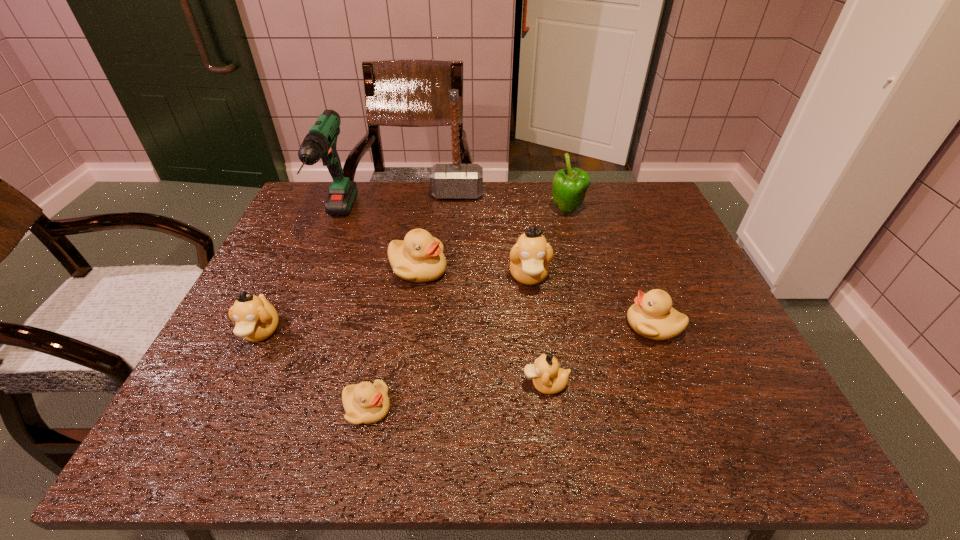
This screenshot has width=960, height=540. In order to click on hammer in this screenshot , I will do `click(455, 180)`.

In order to click on green drill in this screenshot , I will do `click(320, 142)`.

This screenshot has width=960, height=540. I want to click on drill, so click(320, 142).

Identify the location of green bell pepper. Image resolution: width=960 pixels, height=540 pixels. (570, 185).

Find the location of a particular element. Image resolution: width=960 pixels, height=540 pixels. bell pepper is located at coordinates pos(570,185).

Where is `the farthest tan duckling`? The height and width of the screenshot is (540, 960). the farthest tan duckling is located at coordinates (529, 258).

Where is `the tallest duckling`? The image size is (960, 540). the tallest duckling is located at coordinates (529, 258).

At what (x,y) coordinates should I click in order to perform the action: click on the farthest yellow duckling. Please return your answer as a coordinate pair (x, y). The image size is (960, 540). Looking at the image, I should click on (419, 258).

At what (x,y) coordinates should I click in order to perform the action: click on the second farthest tan duckling. Please return your answer as a coordinate pair (x, y). The height and width of the screenshot is (540, 960). Looking at the image, I should click on (256, 319).

The width and height of the screenshot is (960, 540). Identify the location of the leftmost duckling. (256, 319).